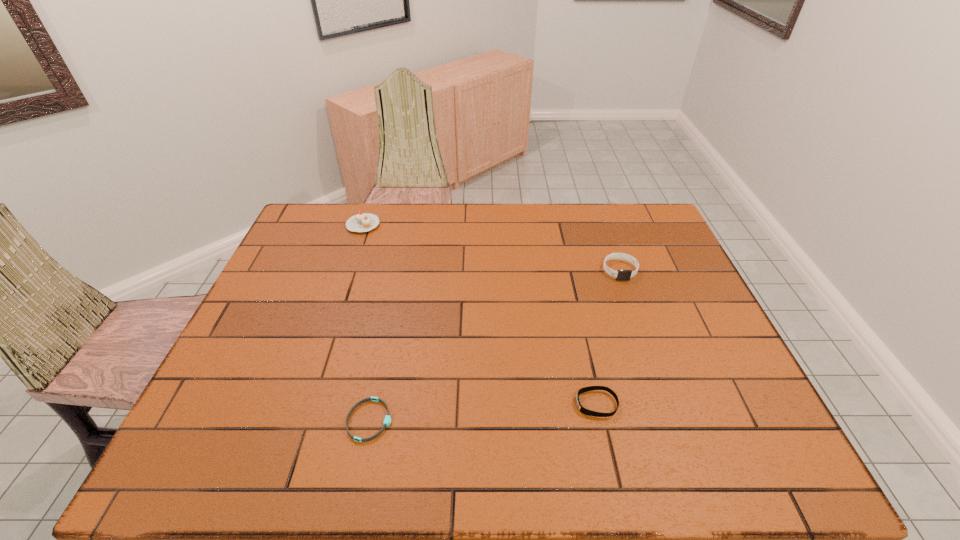
Where is `blank space at the right edge of the desktop`? The width and height of the screenshot is (960, 540). blank space at the right edge of the desktop is located at coordinates (705, 304).

The image size is (960, 540). Find the location of `vacant region at the far left corner of the desktop`. vacant region at the far left corner of the desktop is located at coordinates (340, 210).

Identify the location of vacant space at the near right corner of the desktop. The width and height of the screenshot is (960, 540). (767, 462).

Image resolution: width=960 pixels, height=540 pixels. I want to click on free space between the second object from left to right and the farthest object, so click(x=367, y=322).

Locate an element on the screen. The height and width of the screenshot is (540, 960). vacant point located between the farthest object and the second shortest object is located at coordinates (480, 314).

Identify the location of empty space that is in between the shortest object and the second farthest object. point(494,345).

At what (x,y) coordinates should I click in order to perform the action: click on blank region between the tallest wristband and the farthest object. Please return your answer as a coordinate pair (x, y). Looking at the image, I should click on (492, 247).

Locate an element on the screen. This screenshot has width=960, height=540. free spot between the cupcake and the rightmost object is located at coordinates (492, 247).

At what (x,y) coordinates should I click in order to perform the action: click on free space between the leftmost wristband and the rightmost object. Please return your answer as a coordinate pair (x, y). Looking at the image, I should click on (494, 345).

I want to click on free spot between the shortest wristband and the third shortest object, so click(x=494, y=345).